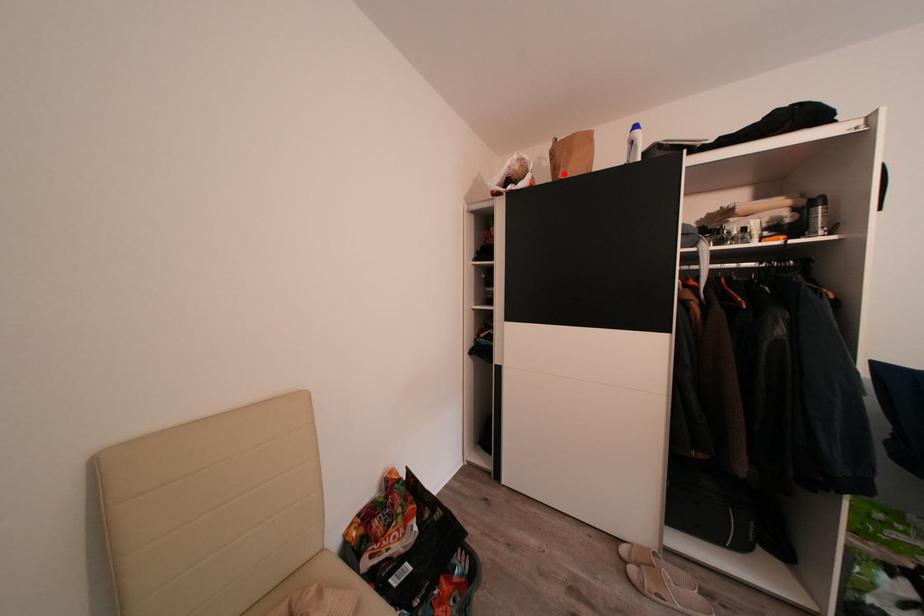
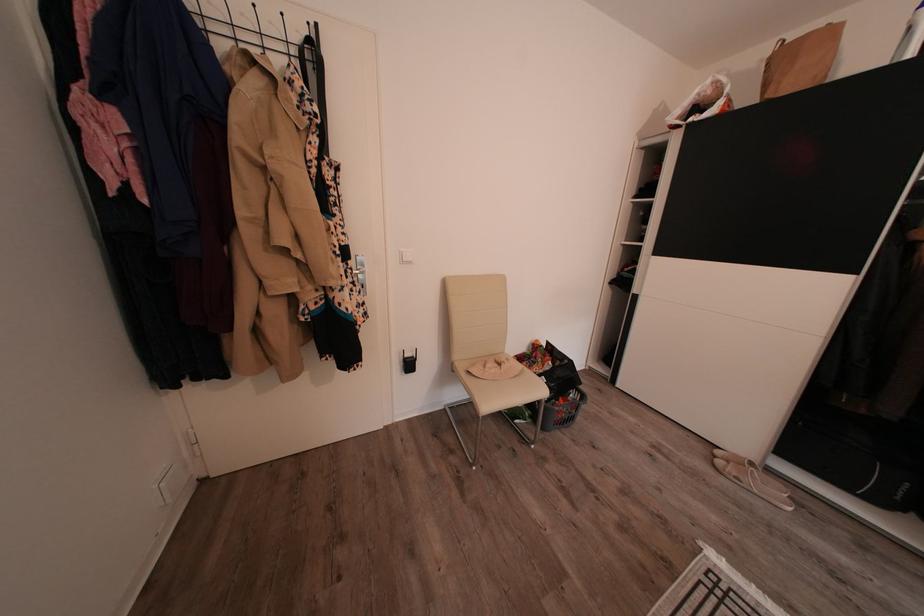
Question: I am providing you with two images of the same scene from different viewpoints. A red point is shown in image1. For the corresponding object point in image2, is it positioned nearer or farther from the camera?

Choices:
 (A) Nearer
 (B) Farther

Answer: (B)